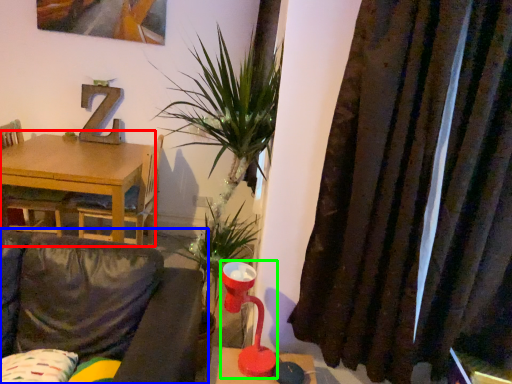
Question: Estimate the real-world distances between objects in this image. Which object is farther from table (highlighted by a red box), studio couch (highlighted by a blue box) or table lamp (highlighted by a green box)?

Choices:
 (A) studio couch
 (B) table lamp

Answer: (B)